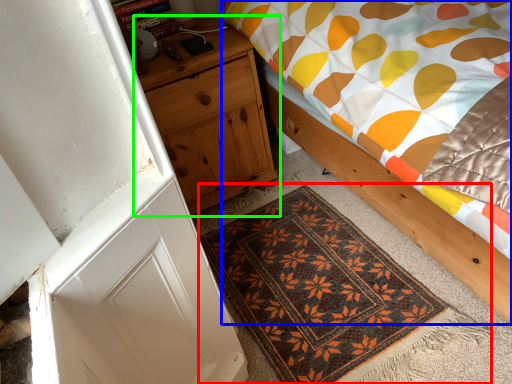
Question: Which object is the closest to the mat (highlighted by a red box)? Choose among these: bed (highlighted by a blue box) or nightstand (highlighted by a green box).

Choices:
 (A) bed
 (B) nightstand

Answer: (A)